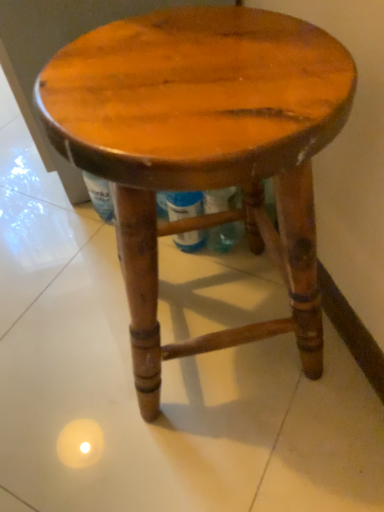
Locate an element on the screen. This screenshot has width=384, height=512. vacant region above wooden stool at center (from a real-world perspective) is located at coordinates (177, 65).